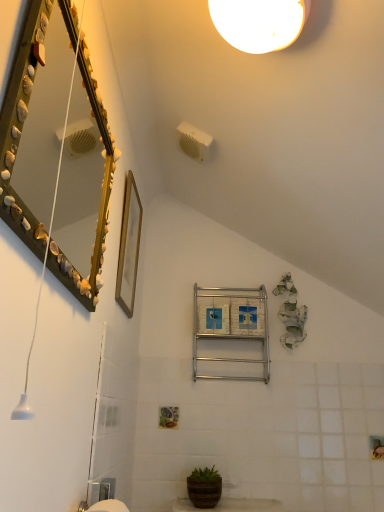
Question: Is brown textured pot at lower center spatially inside silver metallic towel rack at center, or outside of it?

Choices:
 (A) outside
 (B) inside

Answer: (A)

Question: From the image's perspective, is brown textured pot at lower center positioned above or below silver metallic towel rack at center?

Choices:
 (A) above
 (B) below

Answer: (B)

Question: Which object is positioned farthest from the wooden picture frame at upper center?

Choices:
 (A) seashell-covered mirror at upper left
 (B) brown textured pot at lower center
 (C) silver metallic towel rack at center

Answer: (B)

Question: Which of these objects is positioned farthest from the wooden picture frame at upper center?

Choices:
 (A) silver metallic towel rack at center
 (B) seashell-covered mirror at upper left
 (C) brown textured pot at lower center

Answer: (C)